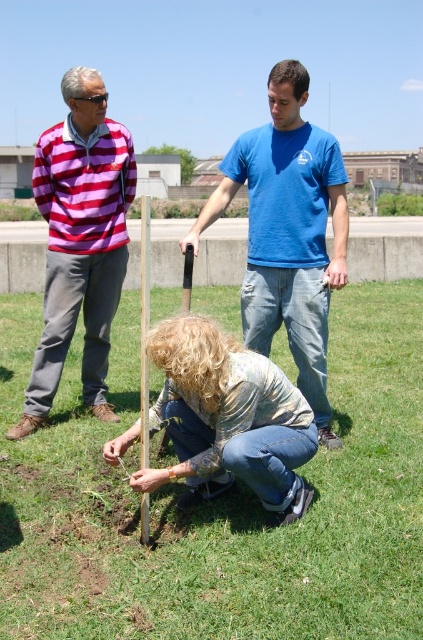
Question: Does green grass at center lie behind striped cotton shirt at left?

Choices:
 (A) no
 (B) yes

Answer: (A)

Question: Among these objects, which one is farthest from the camera?

Choices:
 (A) smooth gray concrete at center
 (B) blue cotton shirt at center
 (C) striped cotton shirt at left

Answer: (A)

Question: Does blue cotton shirt at center appear under smooth gray concrete at center?

Choices:
 (A) yes
 (B) no

Answer: (A)

Question: Does denim jeans at center have a greater width compared to smooth gray concrete at center?

Choices:
 (A) no
 (B) yes

Answer: (A)

Question: Which point is closer to the camera?

Choices:
 (A) green grass at center
 (B) blue cotton shirt at center
 (C) denim jeans at center

Answer: (A)

Question: Which point is farther to the camera?

Choices:
 (A) (290, 344)
 (B) (8, 404)
 (C) (164, 410)

Answer: (B)